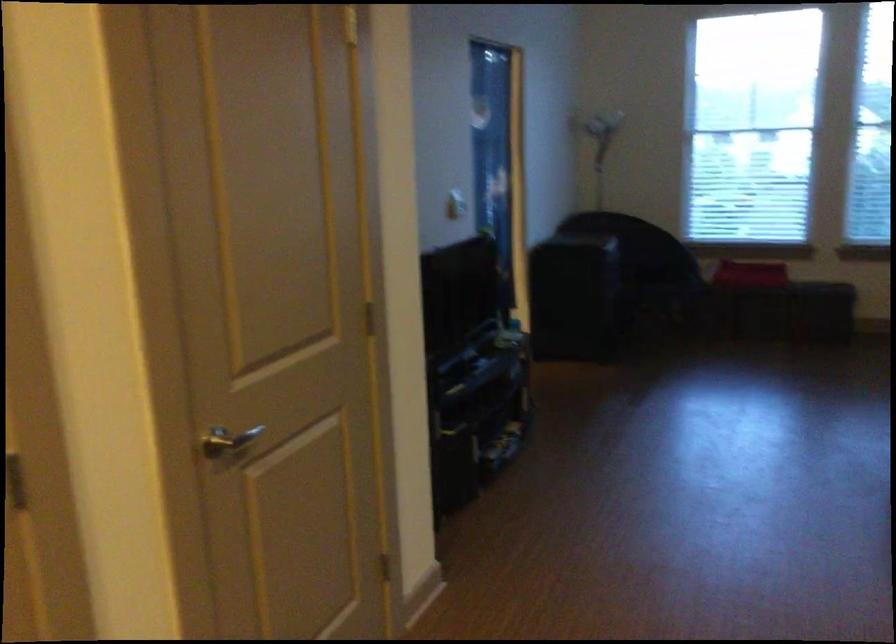
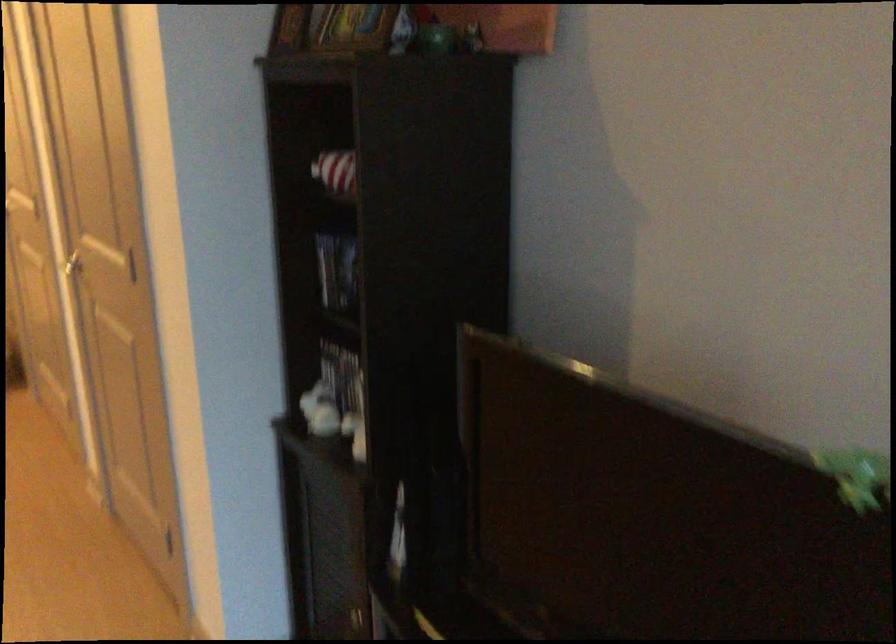
Find the pixel in the second image that matches point (79, 527) in the first image.

(73, 267)